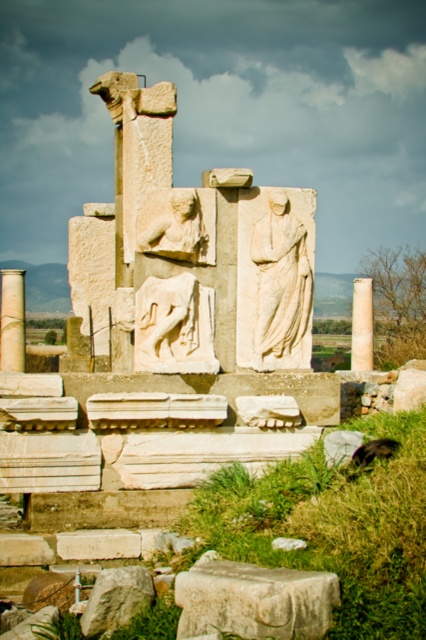
Question: Observing the image, what is the correct spatial positioning of white marble statue at center in reference to white marble column at center?

Choices:
 (A) left
 (B) right

Answer: (A)

Question: Which of the following is the closest to the observer?

Choices:
 (A) matte stone lion at center
 (B) white marble statue at center
 (C) white marble pillar at left
 (D) white marble column at center

Answer: (A)

Question: From the image, what is the correct spatial relationship of white marble horse at center in relation to white marble column at center?

Choices:
 (A) below
 (B) above

Answer: (B)

Question: Which object is the farthest from the white marble column at center?

Choices:
 (A) white marble horse at center
 (B) white marble statue at center
 (C) matte stone lion at center
 (D) white marble pillar at left

Answer: (A)

Question: Which of the following is the closest to the observer?

Choices:
 (A) matte stone lion at center
 (B) white marble column at center

Answer: (A)

Question: Observing the image, what is the correct spatial positioning of white marble statue at center in reference to matte stone lion at center?

Choices:
 (A) left
 (B) right

Answer: (B)